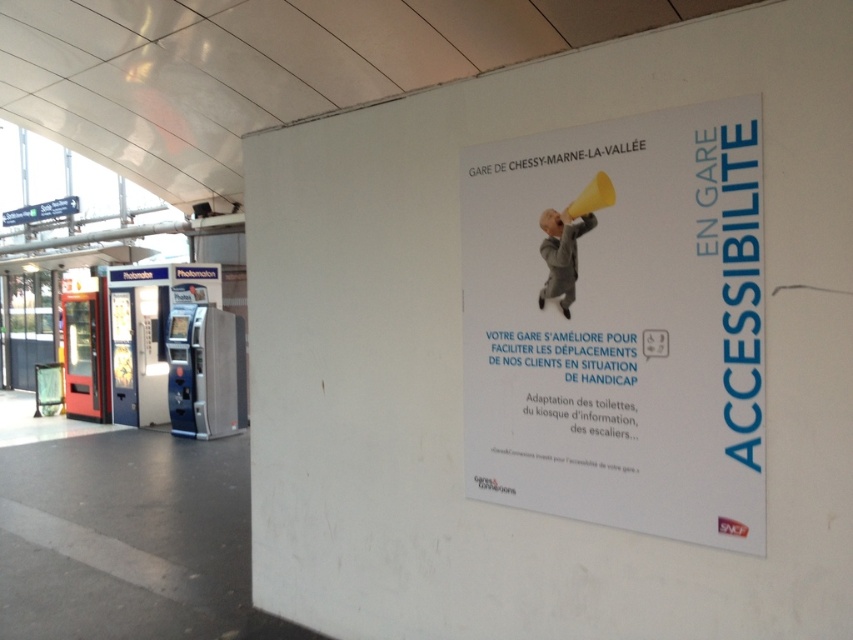
Question: Among these objects, which one is nearest to the camera?

Choices:
 (A) light gray fabric at center
 (B) white paper poster at center

Answer: (B)

Question: Which point is closer to the camera?

Choices:
 (A) (534, 458)
 (B) (561, 273)

Answer: (B)

Question: In this image, where is white paper poster at center located relative to light gray fabric at center?

Choices:
 (A) above
 (B) below

Answer: (B)

Question: Does white paper poster at center come behind light gray fabric at center?

Choices:
 (A) no
 (B) yes

Answer: (A)

Question: Can you confirm if white paper poster at center is positioned above light gray fabric at center?

Choices:
 (A) yes
 (B) no

Answer: (B)